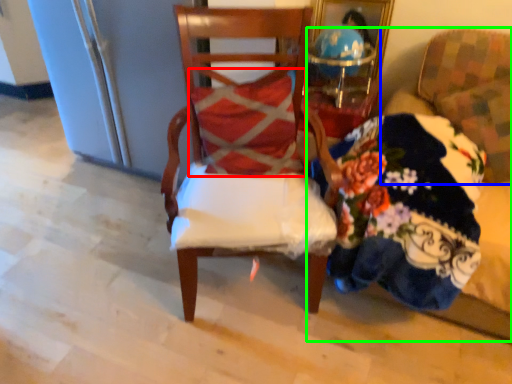
Question: Which object is positioned closest to pillow (highlighted by a red box)? Select from chair (highlighted by a blue box) and couch (highlighted by a green box).

Choices:
 (A) chair
 (B) couch

Answer: (B)